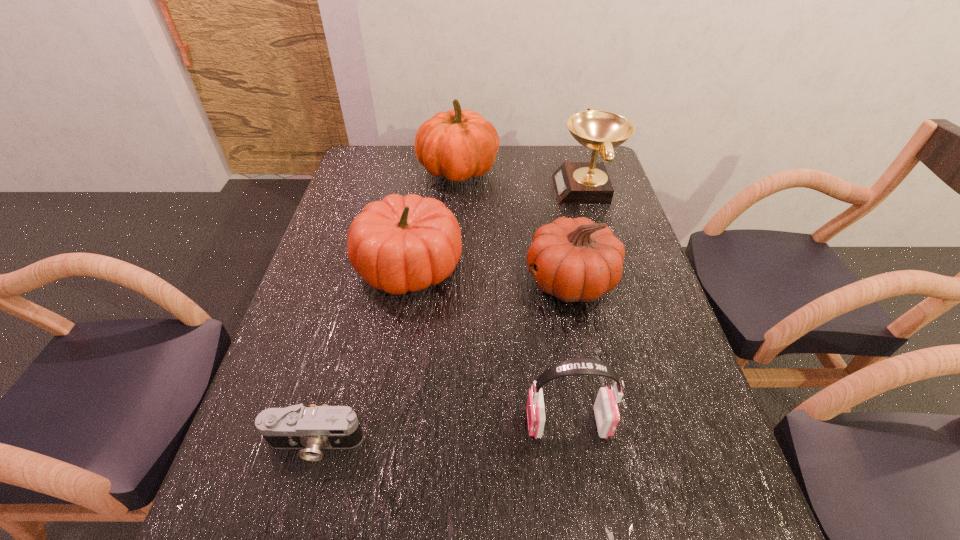
Find the location of a particular element. Image resolution: width=960 pixels, height=540 pixels. vacant space located 0.310m on the outer surface of the earphone is located at coordinates click(x=373, y=423).

The height and width of the screenshot is (540, 960). Find the location of `vacant space situated 0.370m on the outer surface of the earphone`. vacant space situated 0.370m on the outer surface of the earphone is located at coordinates (344, 423).

Where is `free space located 0.320m on the face of the rightmost pumpkin`? The image size is (960, 540). free space located 0.320m on the face of the rightmost pumpkin is located at coordinates (404, 281).

At what (x,y) coordinates should I click in order to perform the action: click on vacant space situated on the face of the rightmost pumpkin. Please return your answer as a coordinate pair (x, y). This screenshot has height=540, width=960. Looking at the image, I should click on (491, 281).

Find the location of a particular element. free spot located 0.350m on the face of the rightmost pumpkin is located at coordinates (x=393, y=281).

This screenshot has width=960, height=540. Find the location of `vacant space located on the lens of the camera`. vacant space located on the lens of the camera is located at coordinates (x=297, y=510).

At what (x,y) coordinates should I click in order to perform the action: click on pumpkin that is at the far edge. Please return your answer as a coordinate pair (x, y). Image resolution: width=960 pixels, height=540 pixels. Looking at the image, I should click on (456, 144).

Image resolution: width=960 pixels, height=540 pixels. I want to click on award that is at the far edge, so click(x=575, y=182).

You are a GUI agent. You are given a task and a screenshot of the screen. Output one action in this format:
    pyautogui.click(x=<x>, y=<y>)
    Task: Click on the pumpkin present at the left edge
    
    Given the screenshot: What is the action you would take?
    pyautogui.click(x=400, y=244)

You are a GUI agent. You are given a task and a screenshot of the screen. Output one action in this format:
    pyautogui.click(x=<x>, y=<y>)
    Task: Click on the camera that is at the left edge
    This screenshot has height=540, width=960.
    Given the screenshot: What is the action you would take?
    pyautogui.click(x=313, y=428)